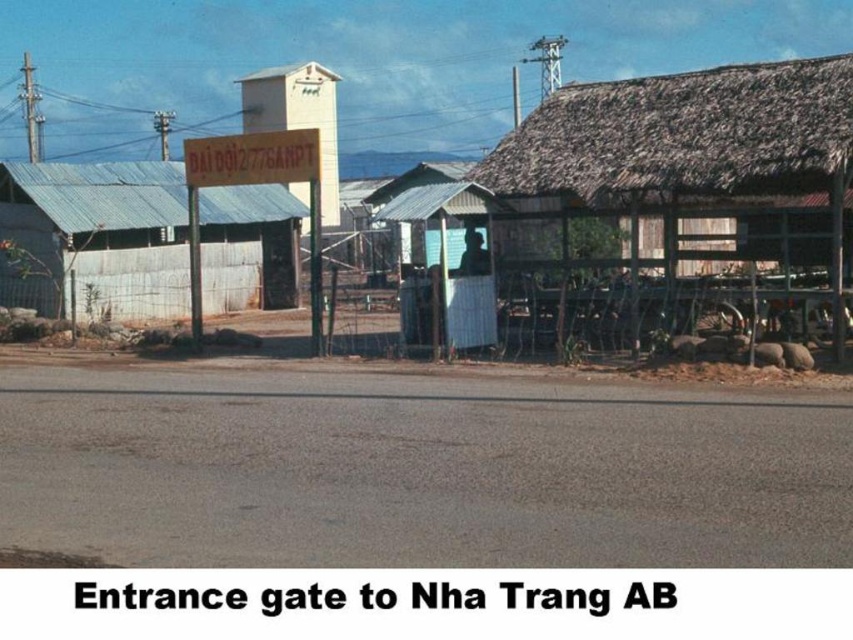
Question: Is metal corrugated roof at upper center closer to camera compared to thatched roof hut at right?

Choices:
 (A) no
 (B) yes

Answer: (B)

Question: Which point is closer to the camera?

Choices:
 (A) (735, 104)
 (B) (677, 144)
 (C) (163, 234)

Answer: (B)

Question: Estimate the real-world distances between objects in this image. Which object is closer to the metal corrugated roof at upper center?

Choices:
 (A) metal corrugated roof hut at left
 (B) thatched roof hut at right

Answer: (B)

Question: Where is metal corrugated roof at upper center located in relation to metal corrugated roof hut at left in the image?

Choices:
 (A) right
 (B) left

Answer: (A)

Question: Is metal corrugated roof at upper center smaller than metal corrugated roof hut at left?

Choices:
 (A) no
 (B) yes

Answer: (A)

Question: Which point is closer to the camera?

Choices:
 (A) (688, 88)
 (B) (676, 93)

Answer: (A)